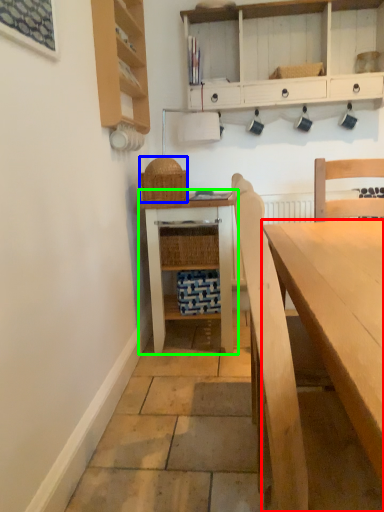
Question: Which is nearer to the desk (highlighted by a red box)? picnic basket (highlighted by a blue box) or table (highlighted by a green box).

Choices:
 (A) picnic basket
 (B) table

Answer: (B)